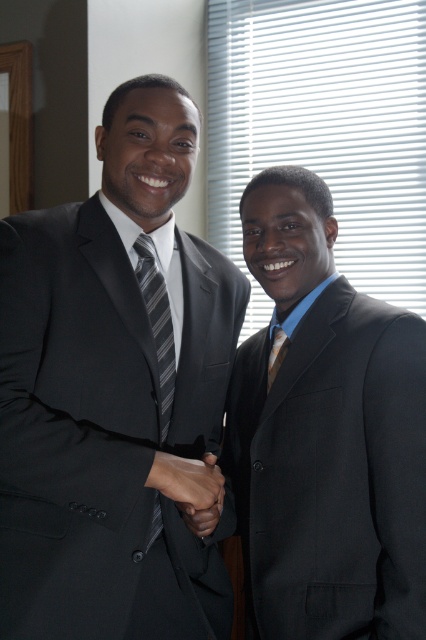
You are a photographer setting up a shoot in this scene. You need to position a spotlight so it illuminates both the matte black suit at left and the striped fabric tie at center without casting shadows on the window with horizontal blinds. Based on their positions, where should you place the spotlight?

The matte black suit at left is above the striped fabric tie at center. To avoid casting shadows on the window with horizontal blinds, place the spotlight above and behind the subjects, directing light downward so it illuminates both the matte black suit at left and the striped fabric tie at center while keeping shadows away from the window.

You are a photographer setting up a shoot in this scene. You need to ensure that the matte black suit at right and the striped fabric tie at center are both visible in the frame. Given their sizes, which object might require you to adjust your camera angle to include it fully?

The matte black suit at right is much taller than the striped fabric tie at center, so you might need to adjust your camera angle to ensure the taller matte black suit at right is fully captured in the frame.

You are a photographer setting up for a formal event. You need to ensure that the striped fabric tie at center and the gold textured tie at right are both visible in the frame. Given their positions, which tie is closer to the left edge of the image?

The striped fabric tie at center is positioned on the left side of gold textured tie at right, so the striped fabric tie at center is closer to the left edge of the image.